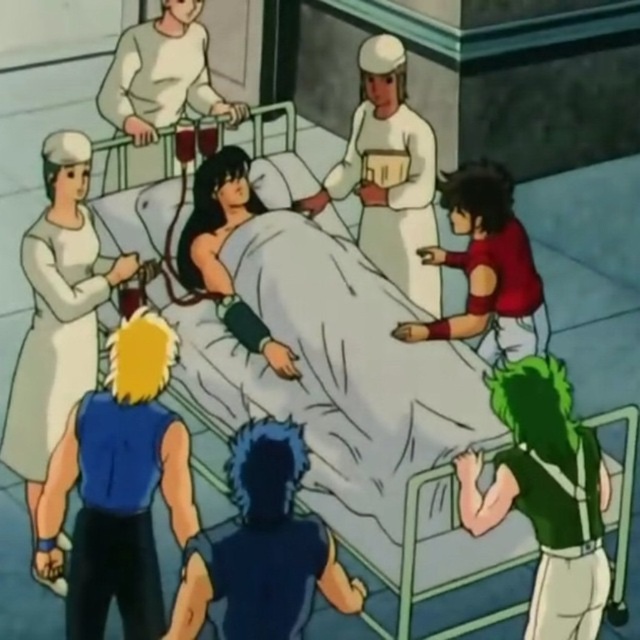
Question: Among these points, which one is nearest to the camera?

Choices:
 (A) (548, 561)
 (B) (184, 115)
 (C) (416, 292)

Answer: (A)

Question: Is blue sleeveless shirt at lower left positioned before red matte shirt at right?

Choices:
 (A) yes
 (B) no

Answer: (A)

Question: Among these points, which one is farthest from the camera?

Choices:
 (A) (156, 132)
 (B) (157, 627)
 (C) (388, 193)
 (D) (532, 413)

Answer: (A)

Question: Can you confirm if blue sleeveless shirt at lower left is positioned above white matte nurse at upper left?

Choices:
 (A) no
 (B) yes

Answer: (A)

Question: Considering the real-world distances, which object is closest to the blue fabric shirt at left?

Choices:
 (A) blue sleeveless shirt at lower left
 (B) red matte shirt at right

Answer: (A)

Question: Considering the relative positions of blue fabric shirt at left and dark blue fabric shirt at center in the image provided, where is blue fabric shirt at left located with respect to dark blue fabric shirt at center?

Choices:
 (A) right
 (B) left

Answer: (B)